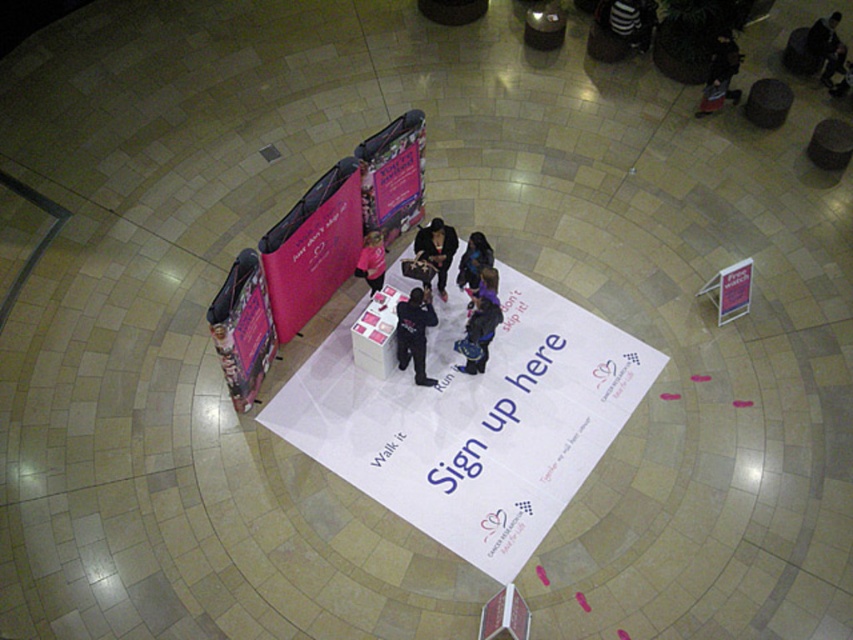
Is point (489, 324) closer to camera compared to point (496, 292)?

That is False.

What do you see at coordinates (479, 332) in the screenshot? The width and height of the screenshot is (853, 640). I see `dark blue fabric jacket at center` at bounding box center [479, 332].

Find the location of a particular element. The height and width of the screenshot is (640, 853). dark blue fabric jacket at center is located at coordinates click(479, 332).

Who is more distant from viewer, (409, 328) or (434, 250)?

Point (434, 250)

Does black matte jacket at center lie behind black leather jacket at center?

No, it is in front of black leather jacket at center.

Is point (418, 342) farther from viewer compared to point (444, 243)?

No, it is not.

The height and width of the screenshot is (640, 853). What are the coordinates of `black matte jacket at center` in the screenshot? It's located at (415, 333).

Can you confirm if black leather jacket at center is shorter than matte black shirt at center?

In fact, black leather jacket at center may be taller than matte black shirt at center.

Who is higher up, black leather jacket at center or matte black shirt at center?

black leather jacket at center is above.

Identify the location of black leather jacket at center. (436, 250).